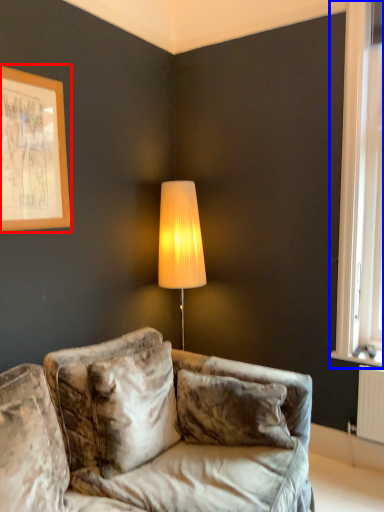
Question: Among these objects, which one is farthest to the camera, picture frame (highlighted by a red box) or window (highlighted by a blue box)?

Choices:
 (A) picture frame
 (B) window

Answer: (B)